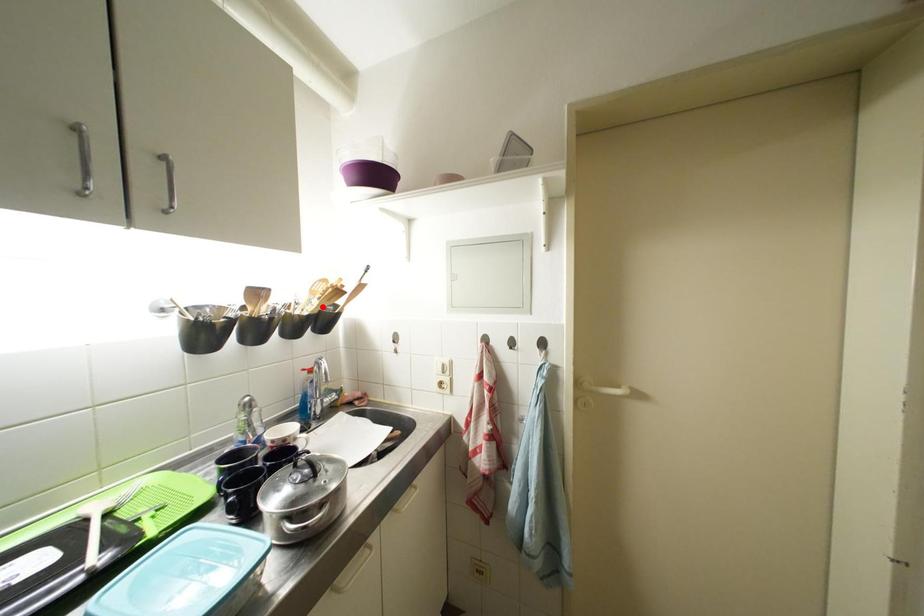
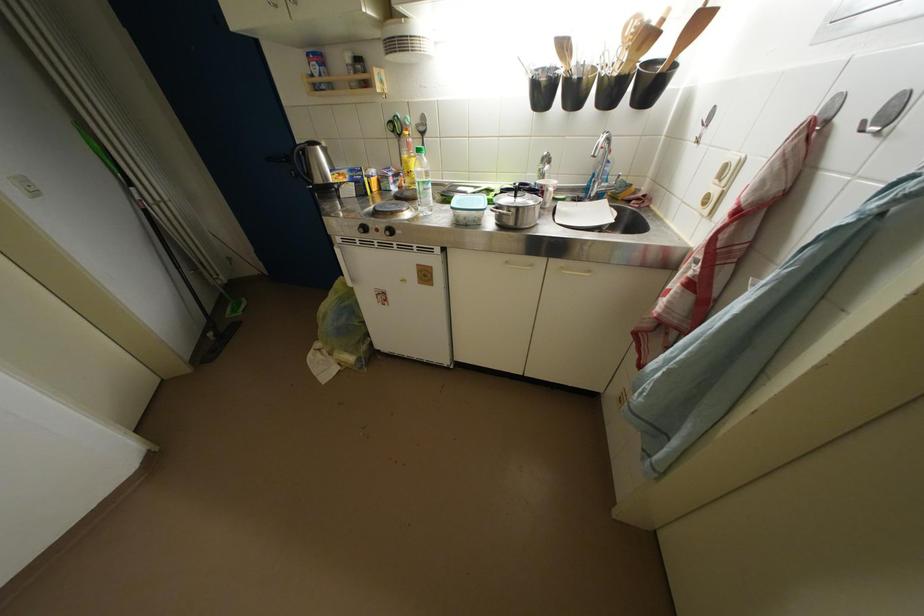
The point at the highlighted location is marked in the first image. Where is the corresponding point in the second image?

(631, 60)